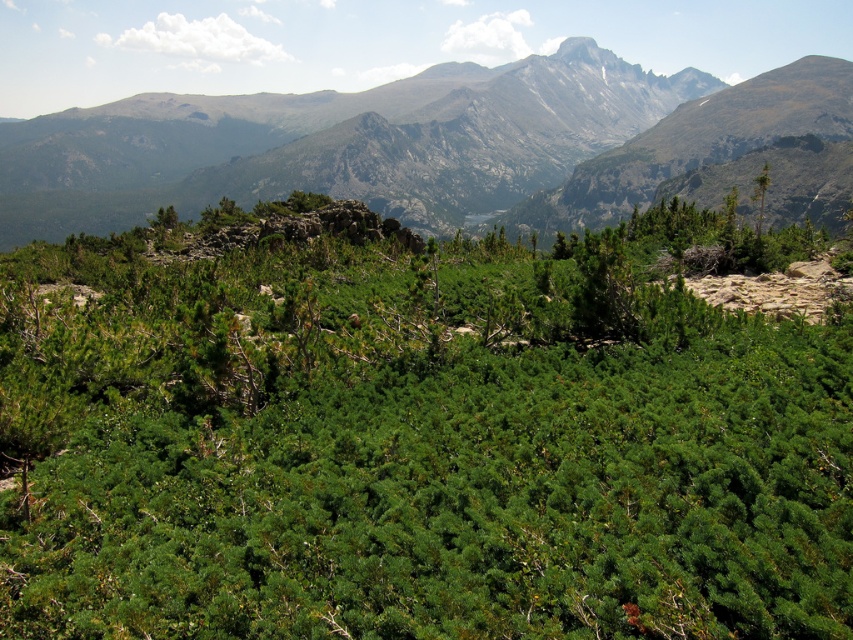
You are a hiker planning to take a photo of the rocky gray mountain range at upper center. You want to ensure the mountain is centered in your photo. Given the coordinates provided, where should you position your camera to capture the mountain perfectly centered?

To center the rocky gray mountain range at upper center in your photo, position your camera at the coordinates provided, which are point (335, 144). This will ensure the mountain is perfectly centered in the frame.